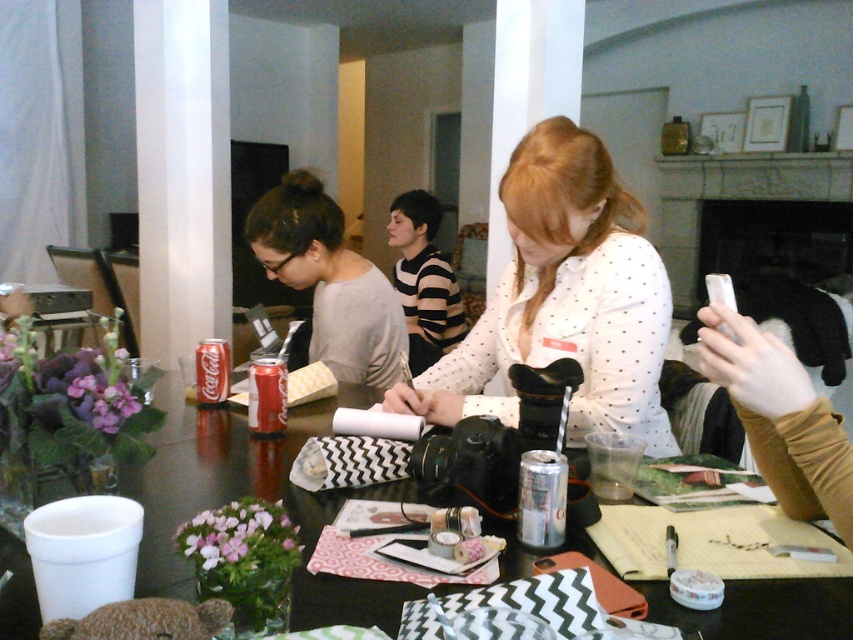
Is white dotted shirt at center bigger than matte gray sweater at center?

Actually, white dotted shirt at center might be smaller than matte gray sweater at center.

Who is more forward, (633, 356) or (320, 349)?

Point (633, 356) is more forward.

Does point (589, 358) lie behind point (352, 333)?

That is False.

Identify the location of white dotted shirt at center. (564, 298).

Between white dotted shirt at center and coca-cola can at center, which one is positioned lower?

Positioned lower is coca-cola can at center.

The width and height of the screenshot is (853, 640). What do you see at coordinates (564, 298) in the screenshot?
I see `white dotted shirt at center` at bounding box center [564, 298].

Find the location of a particular element. white dotted shirt at center is located at coordinates (564, 298).

Is point (349, 256) positioned in front of point (212, 369)?

No.

Image resolution: width=853 pixels, height=640 pixels. In order to click on matte gray sweater at center in this screenshot , I will do `click(329, 282)`.

This screenshot has height=640, width=853. I want to click on matte gray sweater at center, so click(329, 282).